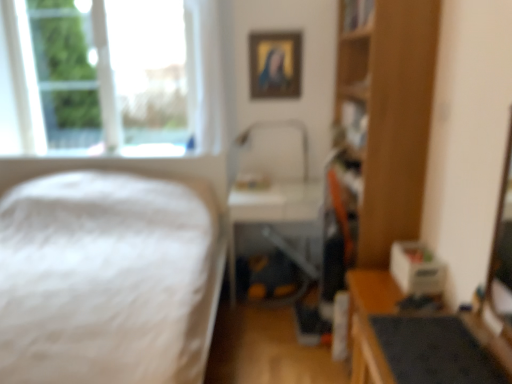
Question: From a real-world perspective, is wooden bookshelf at right over white fluffy bed at left?

Choices:
 (A) no
 (B) yes

Answer: (B)

Question: Does wooden bookshelf at right touch white fluffy bed at left?

Choices:
 (A) no
 (B) yes

Answer: (A)

Question: Would you say wooden bookshelf at right is outside white fluffy bed at left?

Choices:
 (A) no
 (B) yes

Answer: (B)

Question: Is wooden bookshelf at right taller than white fluffy bed at left?

Choices:
 (A) no
 (B) yes

Answer: (B)

Question: Does wooden bookshelf at right have a larger size compared to white fluffy bed at left?

Choices:
 (A) yes
 (B) no

Answer: (B)

Question: Considering the positions of gold-framed portrait at upper center and white fluffy bed at left in the image, is gold-framed portrait at upper center taller or shorter than white fluffy bed at left?

Choices:
 (A) tall
 (B) short

Answer: (B)

Question: Looking at their shapes, would you say gold-framed portrait at upper center is wider or thinner than white fluffy bed at left?

Choices:
 (A) wide
 (B) thin

Answer: (B)

Question: Considering the positions of gold-framed portrait at upper center and white fluffy bed at left in the image, is gold-framed portrait at upper center bigger or smaller than white fluffy bed at left?

Choices:
 (A) big
 (B) small

Answer: (B)

Question: In the image, is gold-framed portrait at upper center positioned in front of or behind white fluffy bed at left?

Choices:
 (A) front
 (B) behind

Answer: (B)

Question: Does point (89, 51) appear closer or farther from the camera than point (430, 86)?

Choices:
 (A) closer
 (B) farther

Answer: (B)

Question: Is transparent glass window at upper left taller or shorter than wooden bookshelf at right?

Choices:
 (A) short
 (B) tall

Answer: (A)

Question: From the image's perspective, is transparent glass window at upper left above or below wooden bookshelf at right?

Choices:
 (A) above
 (B) below

Answer: (A)

Question: From a real-world perspective, relative to wooden bookshelf at right, is transparent glass window at upper left vertically above or below?

Choices:
 (A) below
 (B) above

Answer: (B)

Question: Is transparent glass window at upper left wider or thinner than white fluffy bed at left?

Choices:
 (A) wide
 (B) thin

Answer: (B)

Question: Looking at the image, does transparent glass window at upper left seem bigger or smaller compared to white fluffy bed at left?

Choices:
 (A) small
 (B) big

Answer: (A)